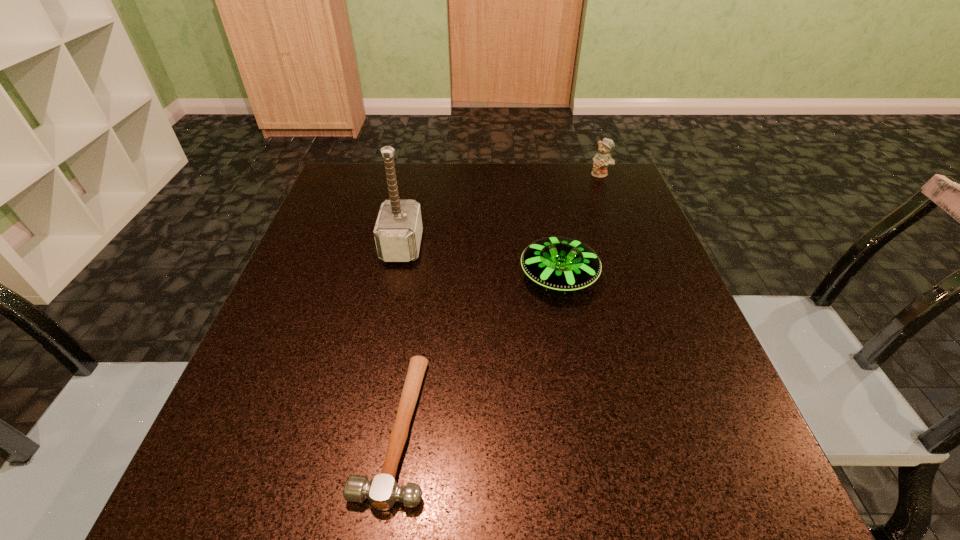
Find the location of a particular element. free location that satisfies the following two spatial constraints: 1. on the front-facing side of the rightmost object; 2. for striking with the head of the tallest object is located at coordinates (629, 246).

Where is `free space that satisfies the following two spatial constraints: 1. on the front-facing side of the teddy bear; 2. for striking with the head of the tallest object`? free space that satisfies the following two spatial constraints: 1. on the front-facing side of the teddy bear; 2. for striking with the head of the tallest object is located at coordinates (629, 246).

This screenshot has width=960, height=540. Find the location of `free space that satisfies the following two spatial constraints: 1. on the back side of the shortest object; 2. for striking with the head of the farther hammer`. free space that satisfies the following two spatial constraints: 1. on the back side of the shortest object; 2. for striking with the head of the farther hammer is located at coordinates (423, 246).